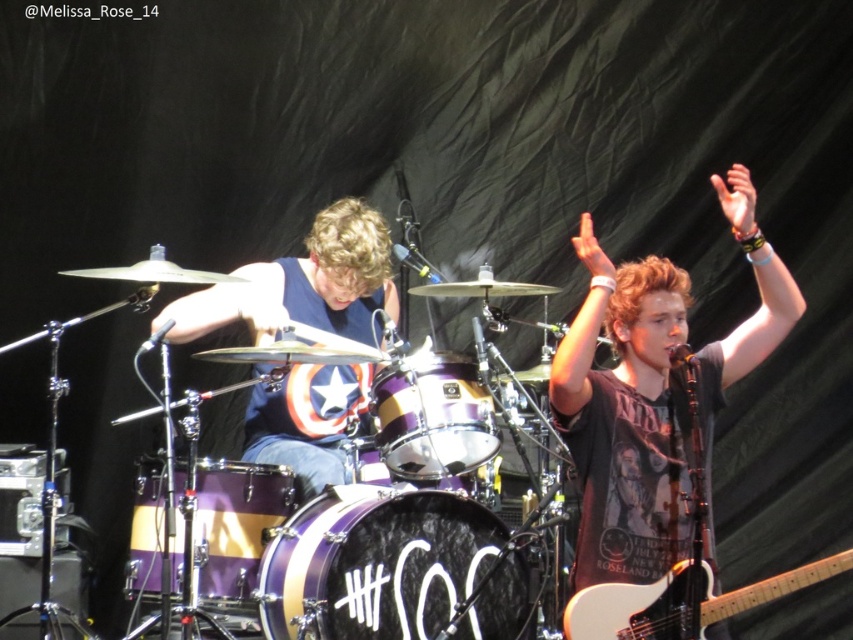
Describe the element at coordinates (625, 417) in the screenshot. This screenshot has height=640, width=853. I see `black cotton t-shirt at center` at that location.

Who is higher up, black cotton t-shirt at center or white glossy electric guitar at lower right?

black cotton t-shirt at center is above.

Find the location of `black cotton t-shirt at center`. black cotton t-shirt at center is located at coordinates (625, 417).

Does point (280, 490) come farther from viewer compared to point (425, 486)?

That is False.

Identify the location of purple glossy drum at center. (235, 524).

Identify the location of purple glossy drum at center. (235, 524).

Describe the element at coordinates (374, 563) in the screenshot. The height and width of the screenshot is (640, 853). I see `black textured drum at center` at that location.

Is point (323, 572) positioned after point (340, 451)?

No, (323, 572) is in front of (340, 451).

Is point (318, 588) positioned after point (376, 276)?

That is False.

The height and width of the screenshot is (640, 853). In order to click on black textured drum at center in this screenshot , I will do `click(374, 563)`.